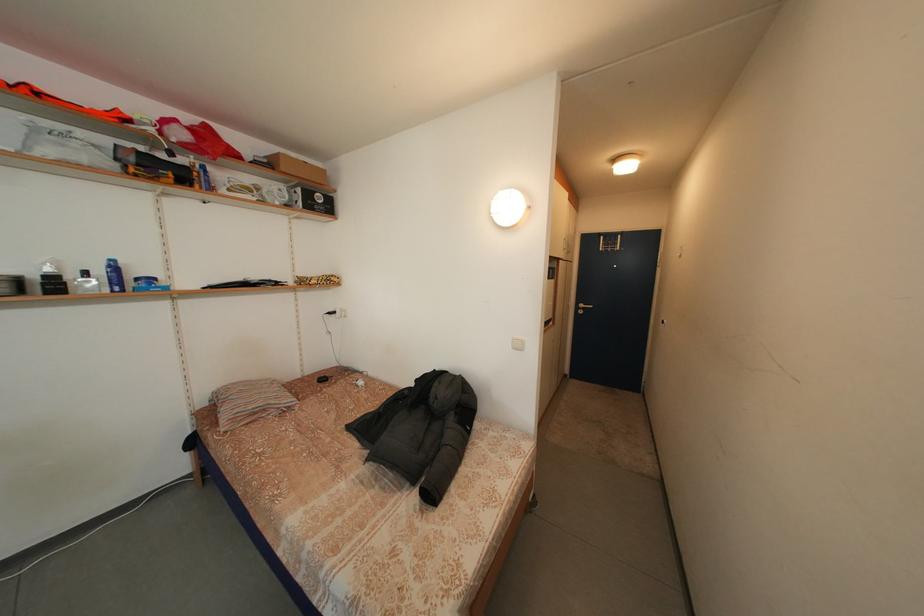
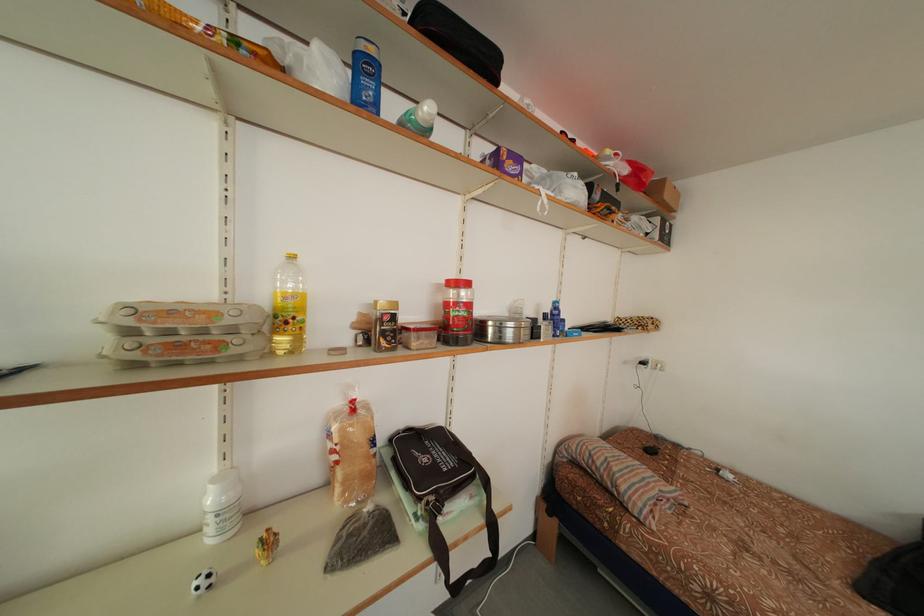
The point at [93,278] is marked in the first image. Where is the corresponding point in the second image?

(553, 322)